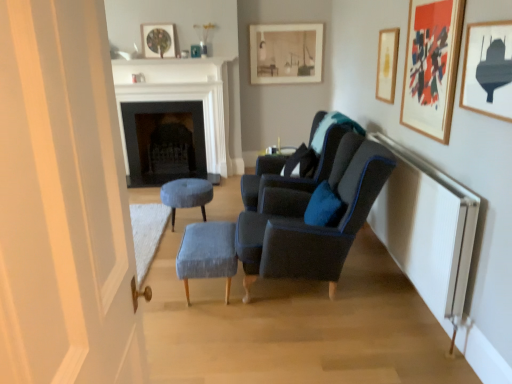
Where is `free region under matte gold picture frame at upper right, which is the 2th picture frame in front-to-back order (from a real-world perspective)`? The height and width of the screenshot is (384, 512). free region under matte gold picture frame at upper right, which is the 2th picture frame in front-to-back order (from a real-world perspective) is located at coordinates (418, 158).